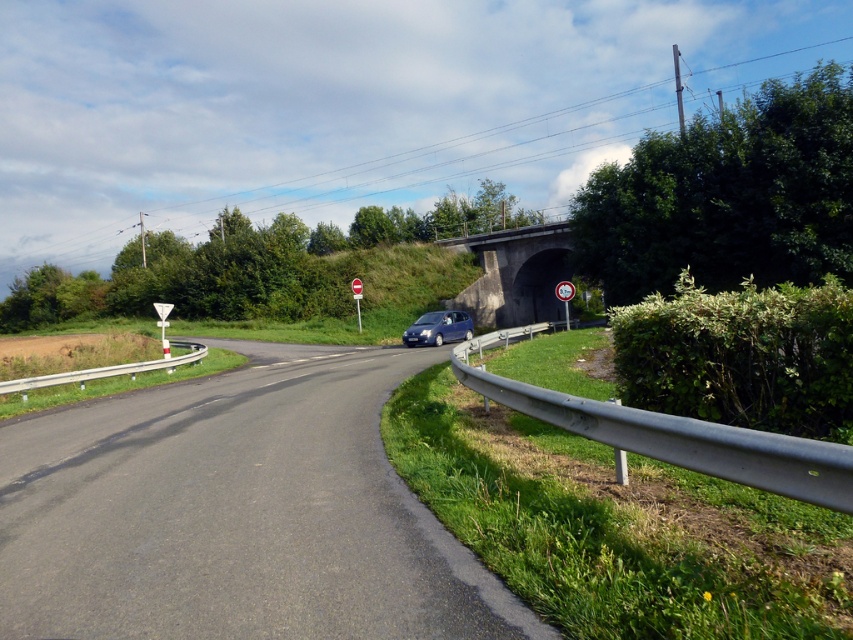
Based on the photo, can you confirm if asphalt road at center is positioned to the left of white plastic sign at center?

Correct, you'll find asphalt road at center to the left of white plastic sign at center.

Is point (13, 515) in front of point (566, 284)?

Yes, it is in front of point (566, 284).

Where is `asphalt road at center`? The height and width of the screenshot is (640, 853). asphalt road at center is located at coordinates (236, 513).

Does asphalt road at center appear on the right side of satin blue car at center?

In fact, asphalt road at center is to the left of satin blue car at center.

Between asphalt road at center and satin blue car at center, which one is positioned lower?

asphalt road at center is lower down.

Describe the element at coordinates (236, 513) in the screenshot. Image resolution: width=853 pixels, height=640 pixels. I see `asphalt road at center` at that location.

This screenshot has width=853, height=640. Find the location of `asphalt road at center`. asphalt road at center is located at coordinates (236, 513).

Based on the photo, does asphalt road at center lie behind red plastic sign at center?

No, asphalt road at center is closer to the viewer.

Is point (276, 628) positioned in front of point (358, 296)?

Yes, it is in front of point (358, 296).

At what (x,y) coordinates should I click in order to perform the action: click on asphalt road at center. Please return your answer as a coordinate pair (x, y). Looking at the image, I should click on (236, 513).